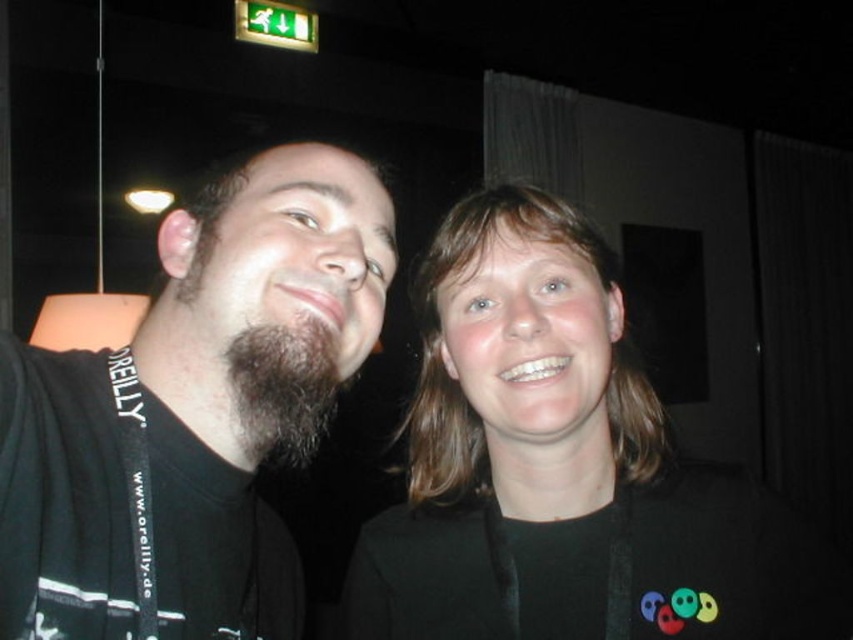
Does black fabric at center come in front of dark brown fuzzy beard at center?

No, black fabric at center is further to the viewer.

Is black fabric at center above dark brown fuzzy beard at center?

Yes, black fabric at center is above dark brown fuzzy beard at center.

Who is more forward, (556, 429) or (317, 436)?

Positioned in front is point (556, 429).

Where is `black fabric at center`? Image resolution: width=853 pixels, height=640 pixels. black fabric at center is located at coordinates (556, 465).

Does black matte t-shirt at left lie in front of dark brown fuzzy beard at center?

Yes, black matte t-shirt at left is closer to the viewer.

Does black matte t-shirt at left have a smaller size compared to dark brown fuzzy beard at center?

No, black matte t-shirt at left is not smaller than dark brown fuzzy beard at center.

Measure the distance between black matte t-shirt at left and camera.

A distance of 39.69 centimeters exists between black matte t-shirt at left and camera.

Find the location of a particular element. black matte t-shirt at left is located at coordinates (193, 412).

Is black matte t-shirt at left taller than black fabric at center?

Yes.

Does black matte t-shirt at left have a smaller size compared to black fabric at center?

Correct, black matte t-shirt at left occupies less space than black fabric at center.

Identify the location of black matte t-shirt at left. (193, 412).

This screenshot has height=640, width=853. In order to click on black matte t-shirt at left in this screenshot , I will do `click(193, 412)`.